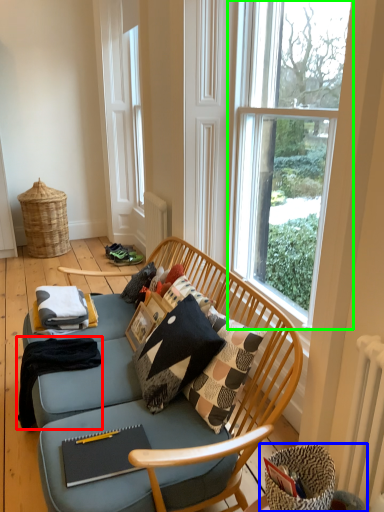
Question: Estimate the real-world distances between objects in this image. Which object is farther from blanket (highlighted by a red box), swivel chair (highlighted by a blue box) or window (highlighted by a green box)?

Choices:
 (A) swivel chair
 (B) window

Answer: (B)